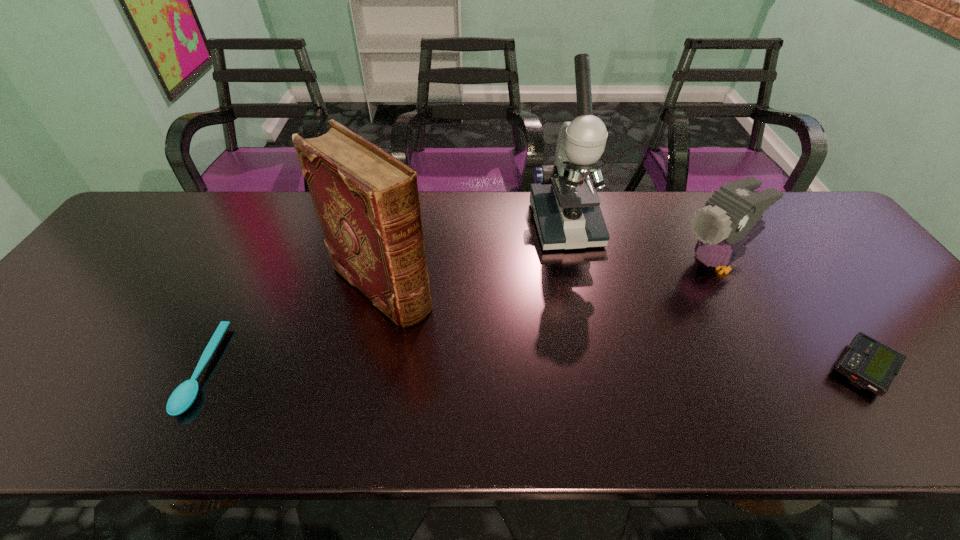
At what (x,y) coordinates should I click in order to perform the action: click on free space on the desktop that is between the spoon and the rightmost object and is positioned on the spine side of the fourth object from right to left. Please return your answer as a coordinate pair (x, y). The width and height of the screenshot is (960, 540). Looking at the image, I should click on coord(478,369).

Where is `free spot on the desktop that is between the spoon and the rightmost object and is positioned at the beak of the bird`? free spot on the desktop that is between the spoon and the rightmost object and is positioned at the beak of the bird is located at coordinates (528, 369).

At what (x,y) coordinates should I click in order to perform the action: click on vacant space on the desktop that is between the shortest object and the fourth tallest object and is positioned at the eyepiece of the third object from right to left. Please return your answer as a coordinate pair (x, y). Looking at the image, I should click on (616, 369).